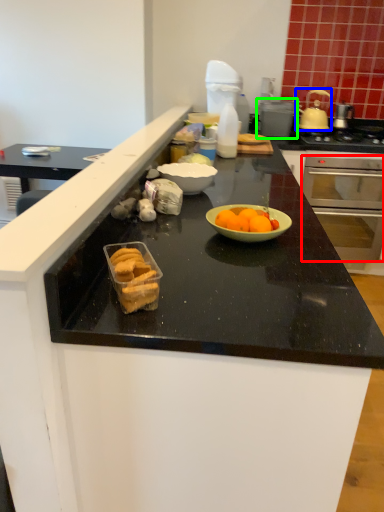
Question: Based on their relative distances, which object is farther from oven (highlighted by a red box)? Choose from pot/pan (highlighted by a blue box) and appliance (highlighted by a green box).

Choices:
 (A) pot/pan
 (B) appliance

Answer: (A)